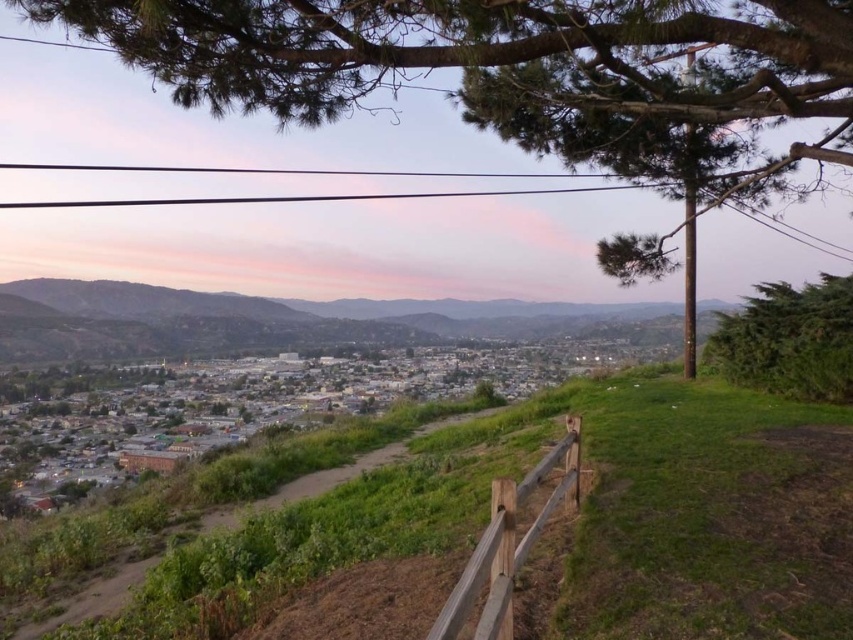
You are standing at the wooden fence on the grassy hillside and want to walk to the town below. There are two points marked on the path leading down. Which point is closer to you, point (596, 52) or point (531, 540)?

Point (596, 52) is closer to you because it is further to the viewer than point (531, 540).

You are standing on the grassy hillside and want to take a photo of both the green leafy tree at upper center and the green leafy bush at right. Which object should you frame first in your camera to ensure both are in the shot?

The green leafy tree at upper center is wider than the green leafy bush at right, so you should frame the tree first to ensure both fit in the shot.